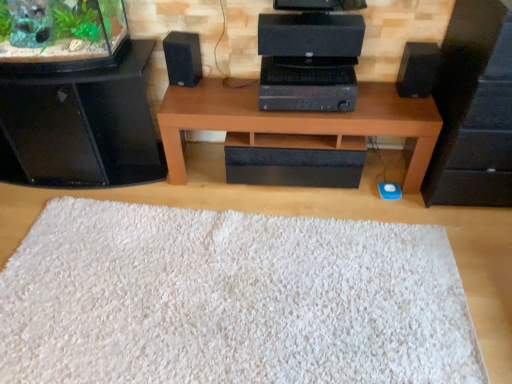
At what (x,y) coordinates should I click in order to perform the action: click on space that is in front of black matte speaker at right, the 2th speaker viewed from the left. Please return your answer as a coordinate pair (x, y). The width and height of the screenshot is (512, 384). Looking at the image, I should click on (413, 112).